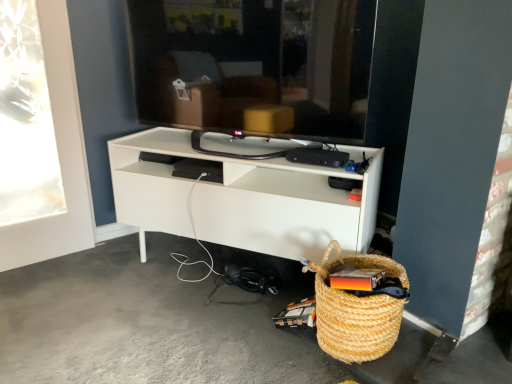
Question: Could you tell me if black glossy tv at center is facing woven straw basket at lower right?

Choices:
 (A) yes
 (B) no

Answer: (B)

Question: From a real-world perspective, is black glossy tv at center on top of woven straw basket at lower right?

Choices:
 (A) yes
 (B) no

Answer: (A)

Question: Is black glossy tv at center shorter than woven straw basket at lower right?

Choices:
 (A) no
 (B) yes

Answer: (A)

Question: Does black glossy tv at center have a larger size compared to woven straw basket at lower right?

Choices:
 (A) no
 (B) yes

Answer: (B)

Question: Is black glossy tv at center outside of woven straw basket at lower right?

Choices:
 (A) no
 (B) yes

Answer: (B)

Question: Does black glossy tv at center have a smaller size compared to woven straw basket at lower right?

Choices:
 (A) no
 (B) yes

Answer: (A)

Question: Considering the relative sizes of white matte shelf at center and gray concrete floor at lower left in the image provided, is white matte shelf at center wider than gray concrete floor at lower left?

Choices:
 (A) no
 (B) yes

Answer: (A)

Question: From the image's perspective, does white matte shelf at center appear lower than gray concrete floor at lower left?

Choices:
 (A) no
 (B) yes

Answer: (A)

Question: From a real-world perspective, does white matte shelf at center stand above gray concrete floor at lower left?

Choices:
 (A) no
 (B) yes

Answer: (B)

Question: Can you confirm if white matte shelf at center is bigger than gray concrete floor at lower left?

Choices:
 (A) yes
 (B) no

Answer: (A)

Question: Considering the relative positions of white matte shelf at center and gray concrete floor at lower left in the image provided, is white matte shelf at center to the right of gray concrete floor at lower left from the viewer's perspective?

Choices:
 (A) yes
 (B) no

Answer: (A)

Question: From a real-world perspective, is white matte shelf at center positioned under gray concrete floor at lower left based on gravity?

Choices:
 (A) yes
 (B) no

Answer: (B)

Question: Is woven straw basket at lower right wider than gray concrete floor at lower left?

Choices:
 (A) no
 (B) yes

Answer: (A)